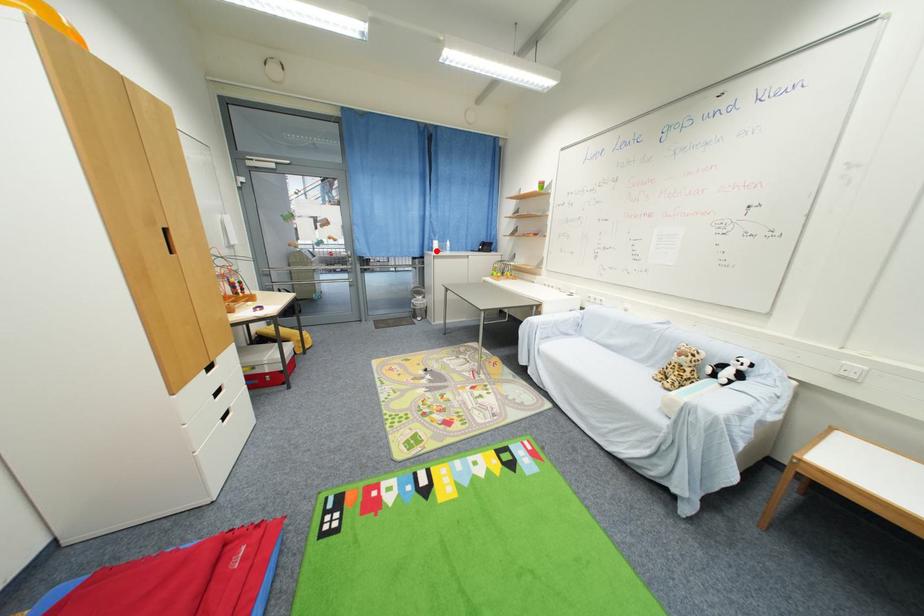
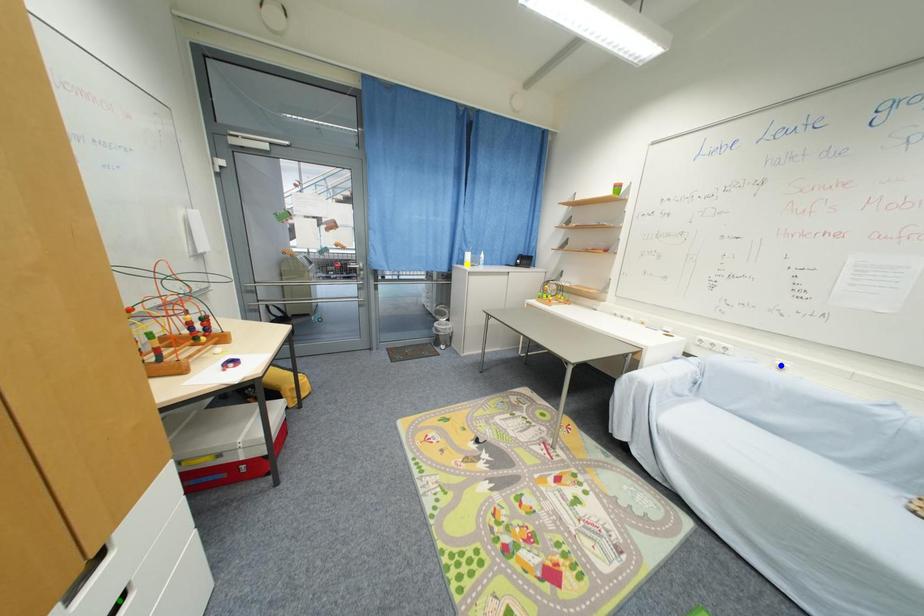
Question: I am providing you with two images of the same scene from different viewpoints. A red point is marked on the first image. You are given multiple points on the second image. Which point in image 2 is actually the same real-world point as the red point in image 1?

Choices:
 (A) blue point
 (B) green point
 (C) yellow point

Answer: (C)